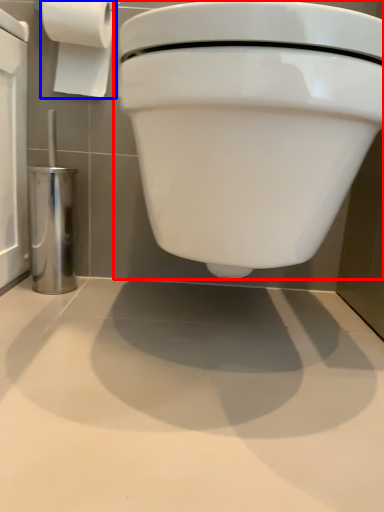
Question: Which object is further to the camera taking this photo, toilet (highlighted by a red box) or toilet paper (highlighted by a blue box)?

Choices:
 (A) toilet
 (B) toilet paper

Answer: (B)